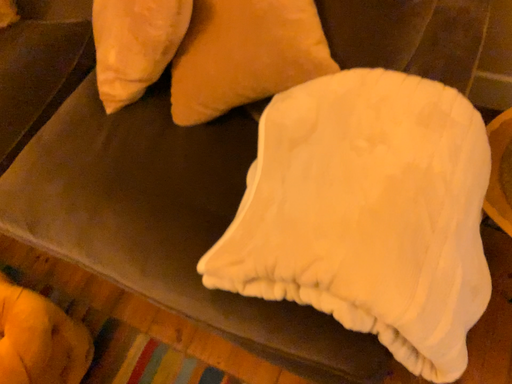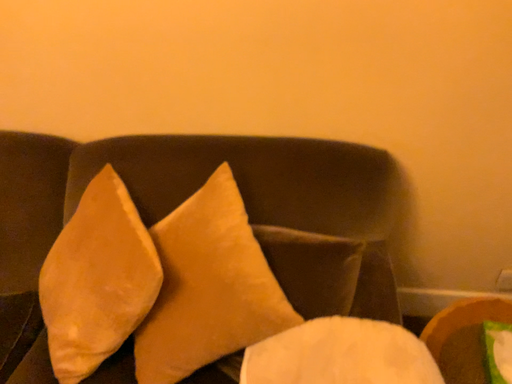
Question: Which way did the camera rotate in the video?

Choices:
 (A) rotated upward
 (B) rotated downward

Answer: (A)